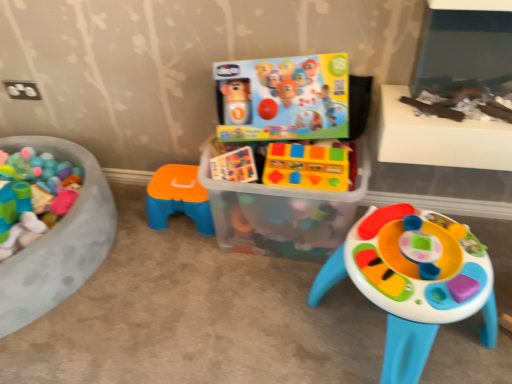
The image size is (512, 384). Describe the element at coordinates (282, 213) in the screenshot. I see `translucent plastic container at center` at that location.

Where is `translucent plastic container at center`? The width and height of the screenshot is (512, 384). translucent plastic container at center is located at coordinates (282, 213).

Measure the distance between plastic colorful activity table at center, arranged as the first toy when viewed from the right, and camera.

The depth of plastic colorful activity table at center, arranged as the first toy when viewed from the right, is 3.54 feet.

Find the location of a particular element. yellow plastic toy blocks at center, arranged as the second toy when viewed from the right is located at coordinates (309, 166).

Is orange plastic stool at center, which appears as the 1th toy when viewed from the left, not near plastic colorful activity table at center, arranged as the first toy when viewed from the right?

orange plastic stool at center, which appears as the 1th toy when viewed from the left, is near plastic colorful activity table at center, arranged as the first toy when viewed from the right, not far away.

In the scene shown: In the image, is orange plastic stool at center, the third toy when ordered from right to left, on the left side or the right side of plastic colorful activity table at center, the third toy in the left-to-right sequence?

Clearly, orange plastic stool at center, the third toy when ordered from right to left, is on the left of plastic colorful activity table at center, the third toy in the left-to-right sequence, in the image.

From the image's perspective, between orange plastic stool at center, the third toy when ordered from right to left, and plastic colorful activity table at center, the third toy in the left-to-right sequence, who is located below?

plastic colorful activity table at center, the third toy in the left-to-right sequence, from the image's perspective.

Can plastic colorful activity table at center, the third toy in the left-to-right sequence, be found inside white plastic table at upper right?

No.

How distant is white plastic table at upper right from plastic colorful activity table at center, arranged as the first toy when viewed from the right?

white plastic table at upper right is 13.18 inches away from plastic colorful activity table at center, arranged as the first toy when viewed from the right.

Considering the relative sizes of white plastic table at upper right and plastic colorful activity table at center, arranged as the first toy when viewed from the right, in the image provided, is white plastic table at upper right bigger than plastic colorful activity table at center, arranged as the first toy when viewed from the right,?

Incorrect, white plastic table at upper right is not larger than plastic colorful activity table at center, arranged as the first toy when viewed from the right.

Can you confirm if white plastic table at upper right is shorter than plastic colorful activity table at center, the third toy in the left-to-right sequence?

Yes, white plastic table at upper right is shorter than plastic colorful activity table at center, the third toy in the left-to-right sequence.

From a real-world perspective, relative to yellow plastic toy blocks at center, arranged as the second toy when viewed from the right, is orange plastic stool at center, the third toy when ordered from right to left, vertically above or below?

orange plastic stool at center, the third toy when ordered from right to left, is situated lower than yellow plastic toy blocks at center, arranged as the second toy when viewed from the right, in the real world.

Looking at this image, can you confirm if orange plastic stool at center, which appears as the 1th toy when viewed from the left, is shorter than yellow plastic toy blocks at center, arranged as the second toy when viewed from the right?

No, orange plastic stool at center, which appears as the 1th toy when viewed from the left, is not shorter than yellow plastic toy blocks at center, arranged as the second toy when viewed from the right.

In the scene shown: Which object is further away from the camera taking this photo, orange plastic stool at center, the third toy when ordered from right to left, or yellow plastic toy blocks at center, arranged as the second toy when viewed from the right?

orange plastic stool at center, the third toy when ordered from right to left, is further from the camera.

In the scene shown: Which point is more forward, [182,179] or [268,166]?

Point [268,166]

Identify the location of table in front of the yellow plastic toy blocks at center, arranged as the second toy when viewed from the right. This screenshot has height=384, width=512. coord(439,137).

Does yellow plastic toy blocks at center, arranged as the second toy when viewed from the right, have a greater height compared to white plastic table at upper right?

No.

How much distance is there between yellow plastic toy blocks at center, arranged as the second toy when viewed from the right, and white plastic table at upper right?

11.18 inches.

Does yellow plastic toy blocks at center, arranged as the second toy when viewed from the right, come in front of white plastic table at upper right?

No, yellow plastic toy blocks at center, arranged as the second toy when viewed from the right, is further to the viewer.

In the scene shown: From a real-world perspective, relative to translucent plastic container at center, is orange plastic stool at center, the third toy when ordered from right to left, vertically above or below?

orange plastic stool at center, the third toy when ordered from right to left, is situated lower than translucent plastic container at center in the real world.

Would you say orange plastic stool at center, the third toy when ordered from right to left, is outside translucent plastic container at center?

Yes, orange plastic stool at center, the third toy when ordered from right to left, is located beyond the bounds of translucent plastic container at center.

Consider the image. Is orange plastic stool at center, the third toy when ordered from right to left, oriented towards translucent plastic container at center?

No, orange plastic stool at center, the third toy when ordered from right to left, does not turn towards translucent plastic container at center.

How different are the orientations of orange plastic stool at center, which appears as the 1th toy when viewed from the left, and translucent plastic container at center in degrees?

The angle between the facing direction of orange plastic stool at center, which appears as the 1th toy when viewed from the left, and the facing direction of translucent plastic container at center is 0.000125 degrees.

Can you confirm if white plastic table at upper right is taller than orange plastic stool at center, which appears as the 1th toy when viewed from the left?

Incorrect, the height of white plastic table at upper right is not larger of that of orange plastic stool at center, which appears as the 1th toy when viewed from the left.

Considering the points (395, 114) and (158, 178), which point is behind, point (395, 114) or point (158, 178)?

Point (158, 178)

Locate an element on the screen. Image resolution: width=512 pixels, height=384 pixels. table located above the orange plastic stool at center, which appears as the 1th toy when viewed from the left (from a real-world perspective) is located at coordinates (439, 137).

From a real-world perspective, which is physically below, white plastic table at upper right or orange plastic stool at center, the third toy when ordered from right to left?

orange plastic stool at center, the third toy when ordered from right to left.

Could you tell me if translucent plastic container at center is turned towards yellow plastic toy blocks at center, which is counted as the 2th toy, starting from the left?

No.

Is translucent plastic container at center completely or partially outside of yellow plastic toy blocks at center, which is counted as the 2th toy, starting from the left?

Yes.

Who is taller, translucent plastic container at center or yellow plastic toy blocks at center, which is counted as the 2th toy, starting from the left?

translucent plastic container at center is taller.

Who is smaller, translucent plastic container at center or yellow plastic toy blocks at center, arranged as the second toy when viewed from the right?

yellow plastic toy blocks at center, arranged as the second toy when viewed from the right.

You are a GUI agent. You are given a task and a screenshot of the screen. Output one action in this format:
    pyautogui.click(x=<x>, y=<y>)
    Task: Click on the 2nd toy counting from the left of the plastic colorful activity table at center, arranged as the first toy when viewed from the right
    The image size is (512, 384).
    Given the screenshot: What is the action you would take?
    pyautogui.click(x=178, y=198)

Identify the location of toy lying in front of the white plastic table at upper right. The width and height of the screenshot is (512, 384). (414, 281).

Estimate the real-world distances between objects in this image. Which object is closer to plastic colorful activity table at center, arranged as the first toy when viewed from the right, yellow plastic toy blocks at center, which is counted as the 2th toy, starting from the left, or orange plastic stool at center, which appears as the 1th toy when viewed from the left?

Based on the image, yellow plastic toy blocks at center, which is counted as the 2th toy, starting from the left, appears to be nearer to plastic colorful activity table at center, arranged as the first toy when viewed from the right.

From the image, which object appears to be nearer to translucent plastic container at center, white plastic table at upper right or orange plastic stool at center, the third toy when ordered from right to left?

orange plastic stool at center, the third toy when ordered from right to left, is closer to translucent plastic container at center.

Considering their positions, is plastic colorful activity table at center, the third toy in the left-to-right sequence, positioned further to yellow plastic toy blocks at center, which is counted as the 2th toy, starting from the left, than translucent plastic container at center?

plastic colorful activity table at center, the third toy in the left-to-right sequence, is further to yellow plastic toy blocks at center, which is counted as the 2th toy, starting from the left.

Based on their spatial positions, is plastic colorful activity table at center, the third toy in the left-to-right sequence, or orange plastic stool at center, the third toy when ordered from right to left, closer to white plastic table at upper right?

plastic colorful activity table at center, the third toy in the left-to-right sequence, is positioned closer to the anchor white plastic table at upper right.

Considering their positions, is yellow plastic toy blocks at center, arranged as the second toy when viewed from the right, positioned further to plastic colorful activity table at center, arranged as the first toy when viewed from the right, than white plastic table at upper right?

white plastic table at upper right.

When comparing their distances from white plastic table at upper right, does translucent plastic container at center or yellow plastic toy blocks at center, arranged as the second toy when viewed from the right, seem further?

Based on the image, translucent plastic container at center appears to be further to white plastic table at upper right.

Considering their positions, is yellow plastic toy blocks at center, arranged as the second toy when viewed from the right, positioned closer to orange plastic stool at center, which appears as the 1th toy when viewed from the left, than white plastic table at upper right?

yellow plastic toy blocks at center, arranged as the second toy when viewed from the right, lies closer to orange plastic stool at center, which appears as the 1th toy when viewed from the left, than the other object.

Considering their positions, is white plastic table at upper right positioned closer to yellow plastic toy blocks at center, which is counted as the 2th toy, starting from the left, than plastic colorful activity table at center, arranged as the first toy when viewed from the right?

white plastic table at upper right is positioned closer to the anchor yellow plastic toy blocks at center, which is counted as the 2th toy, starting from the left.

The height and width of the screenshot is (384, 512). I want to click on toy located between orange plastic stool at center, the third toy when ordered from right to left, and plastic colorful activity table at center, arranged as the first toy when viewed from the right, in the left-right direction, so click(x=309, y=166).

This screenshot has width=512, height=384. In order to click on toy between plastic colorful activity table at center, arranged as the first toy when viewed from the right, and translucent plastic container at center, along the z-axis in this screenshot , I will do `click(309, 166)`.

Identify the location of box between orange plastic stool at center, which appears as the 1th toy when viewed from the left, and plastic colorful activity table at center, the third toy in the left-to-right sequence. (282, 213).

The height and width of the screenshot is (384, 512). I want to click on box located between orange plastic stool at center, which appears as the 1th toy when viewed from the left, and white plastic table at upper right in the left-right direction, so click(x=282, y=213).